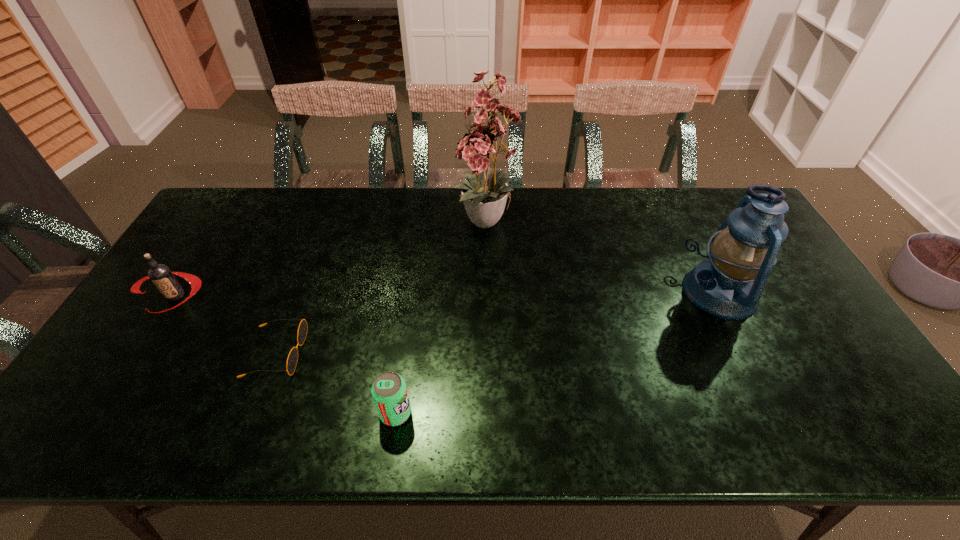
You are a GUI agent. You are given a task and a screenshot of the screen. Output one action in this format:
    pyautogui.click(x=<x>, y=<y>)
    Task: Click on the object that is at the right edge
    This screenshot has height=540, width=960.
    Given the screenshot: What is the action you would take?
    pyautogui.click(x=728, y=285)

In the image, there is a desktop. At what (x,y) coordinates should I click in order to perform the action: click on vacant space at the far edge. Please return your answer as a coordinate pair (x, y). Image resolution: width=960 pixels, height=540 pixels. Looking at the image, I should click on (603, 206).

Identify the location of vacant region at the near edge. The height and width of the screenshot is (540, 960). (591, 432).

Identify the location of free space at the right edge. Image resolution: width=960 pixels, height=540 pixels. (837, 383).

This screenshot has height=540, width=960. Find the location of `free spot between the shortest object and the nearest object`. free spot between the shortest object and the nearest object is located at coordinates (336, 383).

Find the location of a particular element. The width and height of the screenshot is (960, 540). vacant space that's between the fourth object from right to left and the tallest object is located at coordinates click(x=382, y=288).

You are a GUI agent. You are given a task and a screenshot of the screen. Output one action in this format:
    pyautogui.click(x=<x>, y=<y>)
    Task: Click on the free space between the third shortest object and the pop soda
    Image resolution: width=960 pixels, height=540 pixels.
    Given the screenshot: What is the action you would take?
    pyautogui.click(x=285, y=355)

At what (x,y) coordinates should I click in order to perform the action: click on free space between the rightmost object and the nearest object. Please return your answer as a coordinate pair (x, y). The width and height of the screenshot is (960, 540). Looking at the image, I should click on (558, 353).

At what (x,y) coordinates should I click in order to perform the action: click on empty space between the third object from left to right and the lantern. Please return your answer as a coordinate pair (x, y). The image size is (960, 540). Looking at the image, I should click on (558, 353).

This screenshot has width=960, height=540. In order to click on vacant area that lies between the lantern and the second object from right to left in this screenshot , I will do tap(604, 258).